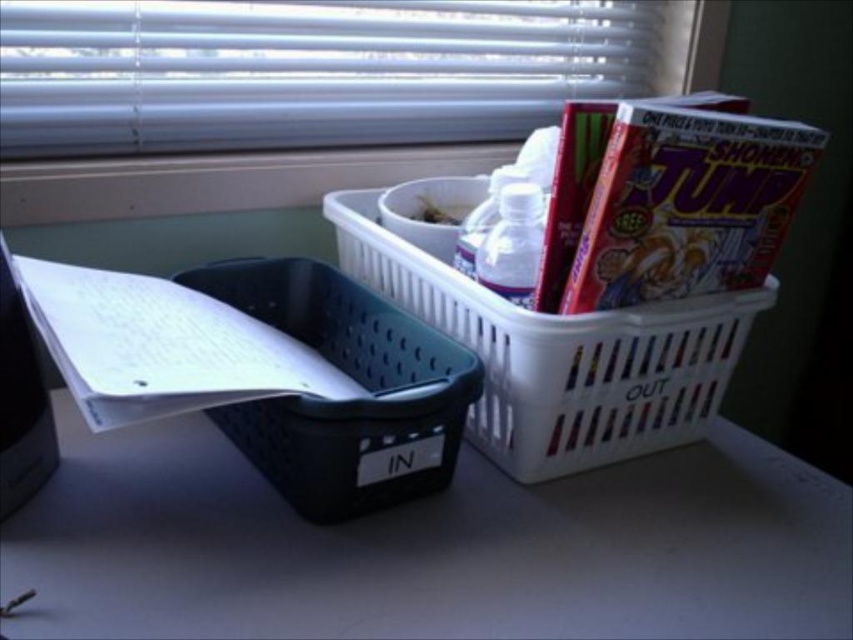
You are organizing your desk and need to know which object takes up more space between the white plastic blinds at upper center and the white paper at left. Which one is larger?

The white plastic blinds at upper center is bigger than white paper at left, so the white plastic blinds at upper center takes up more space.